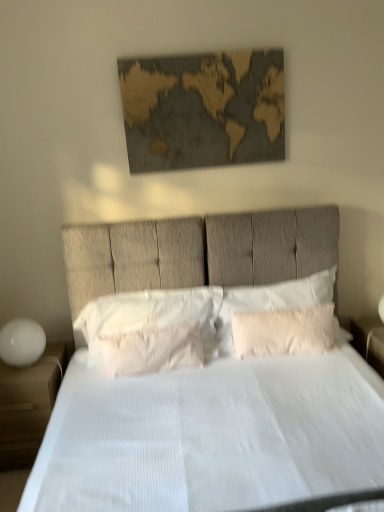
What do you see at coordinates (150, 350) in the screenshot? This screenshot has width=384, height=512. I see `white textured pillow at center, the 2th pillow positioned from the right` at bounding box center [150, 350].

Describe the element at coordinates (28, 405) in the screenshot. I see `white matte nightstand at lower left, arranged as the second nightstand when viewed from the right` at that location.

This screenshot has height=512, width=384. I want to click on white textured bed at center, so (x=212, y=433).

Is point (171, 347) behind point (11, 334)?

Yes, point (171, 347) is farther from viewer.

Is white textured pillow at center, the 2th pillow from the left, bigger or smaller than white glossy sphere at left?

Clearly, white textured pillow at center, the 2th pillow from the left, is larger in size than white glossy sphere at left.

From a real-world perspective, which is physically below, white textured pillow at center, the 2th pillow positioned from the right, or white glossy sphere at left?

white textured pillow at center, the 2th pillow positioned from the right, is physically lower.

What's the angular difference between white textured bed at center and white textured pillow at center, which is counted as the 1th pillow, starting from the right,'s facing directions?

There is a 1.61-degree angle between the facing directions of white textured bed at center and white textured pillow at center, which is counted as the 1th pillow, starting from the right.

Is white textured bed at center turned away from white textured pillow at center, arranged as the third pillow when viewed from the left?

Correct, white textured bed at center is looking away from white textured pillow at center, arranged as the third pillow when viewed from the left.

Considering the sizes of objects white textured bed at center and white textured pillow at center, arranged as the third pillow when viewed from the left, in the image provided, who is taller, white textured bed at center or white textured pillow at center, arranged as the third pillow when viewed from the left,?

Standing taller between the two is white textured bed at center.

Which is behind, point (213, 482) or point (273, 306)?

The point (273, 306) is farther from the camera.

From a real-world perspective, which is physically below, white glossy nightstand at right, placed as the first nightstand when sorted from right to left, or gold textured map at upper center?

white glossy nightstand at right, placed as the first nightstand when sorted from right to left, from a real-world perspective.

Which is closer, (x=365, y=354) or (x=245, y=141)?

The point (x=245, y=141) is closer to the camera.

Which object is positioned more to the right, white glossy nightstand at right, placed as the first nightstand when sorted from right to left, or gold textured map at upper center?

white glossy nightstand at right, placed as the first nightstand when sorted from right to left, is more to the right.

Would you say white glossy nightstand at right, the 2th nightstand from the left, is inside or outside gold textured map at upper center?

white glossy nightstand at right, the 2th nightstand from the left, is spatially situated outside gold textured map at upper center.

Could you tell me if gold textured map at upper center is turned towards white textured pillow at center, which is counted as the 1th pillow, starting from the right?

No, gold textured map at upper center is not aimed at white textured pillow at center, which is counted as the 1th pillow, starting from the right.

Considering their positions, is gold textured map at upper center located in front of or behind white textured pillow at center, which is counted as the 1th pillow, starting from the right?

In the image, gold textured map at upper center appears behind white textured pillow at center, which is counted as the 1th pillow, starting from the right.

From a real-world perspective, is gold textured map at upper center above or below white textured pillow at center, which is counted as the 1th pillow, starting from the right?

From a real-world perspective, gold textured map at upper center is physically above white textured pillow at center, which is counted as the 1th pillow, starting from the right.

Which is correct: gold textured map at upper center is inside white textured pillow at center, arranged as the third pillow when viewed from the left, or outside of it?

The correct answer is: outside.

Can you tell me how much white textured bed at center and gold textured map at upper center differ in facing direction?

The angle between the facing direction of white textured bed at center and the facing direction of gold textured map at upper center is 0.616 degrees.

Can you confirm if white textured bed at center is wider than gold textured map at upper center?

Indeed, white textured bed at center has a greater width compared to gold textured map at upper center.

Identify the location of bed in front of the gold textured map at upper center. (212, 433).

From the image's perspective, is white glossy nightstand at right, placed as the first nightstand when sorted from right to left, under white textured pillow at center, arranged as the third pillow when viewed from the left?

Yes.

From a real-world perspective, who is located lower, white glossy nightstand at right, the 2th nightstand from the left, or white textured pillow at center, arranged as the third pillow when viewed from the left?

white glossy nightstand at right, the 2th nightstand from the left.

Which object is positioned more to the left, white glossy nightstand at right, the 2th nightstand from the left, or white textured pillow at center, which is counted as the 1th pillow, starting from the right?

white textured pillow at center, which is counted as the 1th pillow, starting from the right, is more to the left.

Is white glossy nightstand at right, the 2th nightstand from the left, located outside white textured bed at center?

white glossy nightstand at right, the 2th nightstand from the left, lies outside white textured bed at center's area.

Which is more to the right, white glossy nightstand at right, placed as the first nightstand when sorted from right to left, or white textured bed at center?

From the viewer's perspective, white glossy nightstand at right, placed as the first nightstand when sorted from right to left, appears more on the right side.

Is point (366, 327) in front of point (197, 500)?

No, (366, 327) is further to viewer.

Locate an element on the screen. bed located in front of the white glossy nightstand at right, the 2th nightstand from the left is located at coordinates (212, 433).

Identify the location of pillow below the white glossy sphere at left (from the image's perspective). Image resolution: width=384 pixels, height=512 pixels. (150, 350).

Where is `bed that appears below the white textured pillow at center, which is counted as the 1th pillow, starting from the right (from a real-world perspective)`? This screenshot has height=512, width=384. bed that appears below the white textured pillow at center, which is counted as the 1th pillow, starting from the right (from a real-world perspective) is located at coordinates (212, 433).

Which object lies further to the anchor point white glossy sphere at left, white glossy nightstand at right, the 2th nightstand from the left, or white textured pillow at center, the 2th pillow positioned from the right?

white glossy nightstand at right, the 2th nightstand from the left, lies further to white glossy sphere at left than the other object.

Based on the photo, from the image, which object appears to be nearer to white matte nightstand at lower left, which is counted as the first nightstand, starting from the left, white textured pillow at center, arranged as the third pillow when viewed from the left, or white textured pillow at center, which appears as the 1th pillow when viewed from the left?

Among the two, white textured pillow at center, which appears as the 1th pillow when viewed from the left, is located nearer to white matte nightstand at lower left, which is counted as the first nightstand, starting from the left.

Looking at this image, which object lies nearer to the anchor point white textured pillow at center, which is counted as the 1th pillow, starting from the right, white textured pillow at center, the 2th pillow from the left, or white textured bed at center?

white textured pillow at center, the 2th pillow from the left, lies closer to white textured pillow at center, which is counted as the 1th pillow, starting from the right, than the other object.

Looking at the image, which one is located closer to white textured pillow at center, which is counted as the 1th pillow, starting from the right, white textured pillow at center, the third pillow from the right, or white textured pillow at center, the 2th pillow positioned from the right?

The object closer to white textured pillow at center, which is counted as the 1th pillow, starting from the right, is white textured pillow at center, the third pillow from the right.

Looking at the image, which one is located closer to white glossy sphere at left, white textured bed at center or white textured pillow at center, the 2th pillow from the left?

white textured pillow at center, the 2th pillow from the left.

When comparing their distances from white matte nightstand at lower left, arranged as the second nightstand when viewed from the right, does white textured pillow at center, the 2th pillow positioned from the right, or white textured pillow at center, the third pillow from the right, seem closer?

white textured pillow at center, the 2th pillow positioned from the right, is positioned closer to the anchor white matte nightstand at lower left, arranged as the second nightstand when viewed from the right.

Which object lies further to the anchor point white textured pillow at center, arranged as the third pillow when viewed from the left, white textured pillow at center, the third pillow from the right, or white matte nightstand at lower left, which is counted as the first nightstand, starting from the left?

Based on the image, white matte nightstand at lower left, which is counted as the first nightstand, starting from the left, appears to be further to white textured pillow at center, arranged as the third pillow when viewed from the left.

From the image, which object appears to be farther from white textured pillow at center, which is counted as the 1th pillow, starting from the right, white textured pillow at center, which appears as the 1th pillow when viewed from the left, or white glossy sphere at left?

Based on the image, white glossy sphere at left appears to be further to white textured pillow at center, which is counted as the 1th pillow, starting from the right.

Where is `pillow located between white textured bed at center and white matte nightstand at lower left, which is counted as the first nightstand, starting from the left, in the depth direction`? pillow located between white textured bed at center and white matte nightstand at lower left, which is counted as the first nightstand, starting from the left, in the depth direction is located at coordinates (x=150, y=350).

At what (x,y) coordinates should I click in order to perform the action: click on bedside lamp between white textured bed at center and white glossy nightstand at right, the 2th nightstand from the left, along the z-axis. Please return your answer as a coordinate pair (x, y). Looking at the image, I should click on [22, 342].

I want to click on nightstand between white glossy sphere at left and white glossy nightstand at right, placed as the first nightstand when sorted from right to left, in the horizontal direction, so click(x=28, y=405).

Identify the location of nightstand between white glossy sphere at left and white textured pillow at center, the 2th pillow positioned from the right. The width and height of the screenshot is (384, 512). (28, 405).